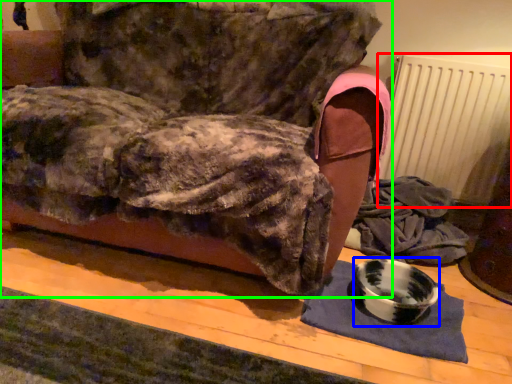
Question: Considering the real-world distances, which object is farthest from radiator (highlighted by a red box)? bowl (highlighted by a blue box) or furniture (highlighted by a green box)?

Choices:
 (A) bowl
 (B) furniture

Answer: (B)